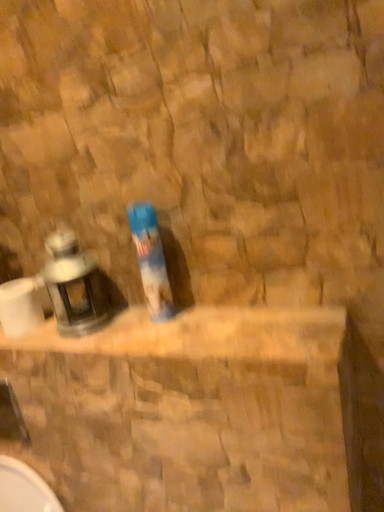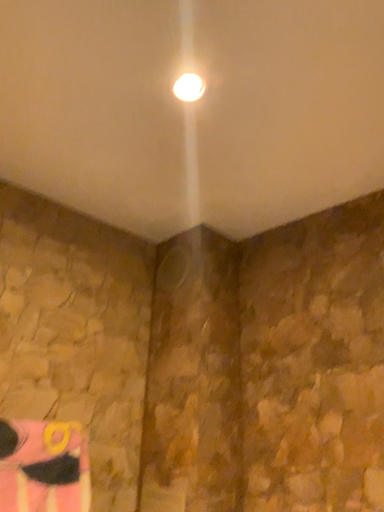
Question: Which way did the camera rotate in the video?

Choices:
 (A) rotated left
 (B) rotated right

Answer: (A)